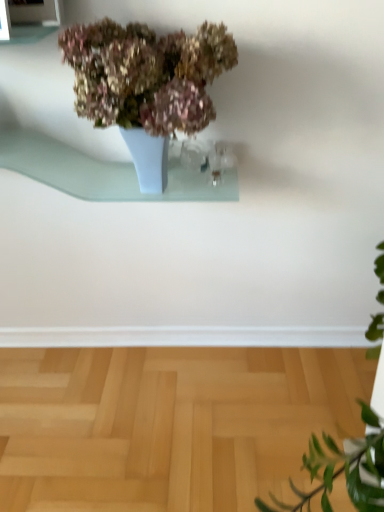
Question: From a real-world perspective, is matte ceramic vase at upper center physically above light wood parquet floor at lower center?

Choices:
 (A) yes
 (B) no

Answer: (A)

Question: From the image's perspective, would you say matte ceramic vase at upper center is shown under light wood parquet floor at lower center?

Choices:
 (A) yes
 (B) no

Answer: (B)

Question: Is matte ceramic vase at upper center in contact with light wood parquet floor at lower center?

Choices:
 (A) yes
 (B) no

Answer: (B)

Question: Is matte ceramic vase at upper center positioned in front of light wood parquet floor at lower center?

Choices:
 (A) yes
 (B) no

Answer: (A)

Question: Is matte ceramic vase at upper center positioned with its back to light wood parquet floor at lower center?

Choices:
 (A) yes
 (B) no

Answer: (B)

Question: Is light wood parquet floor at lower center bigger or smaller than matte ceramic vase at upper center?

Choices:
 (A) big
 (B) small

Answer: (A)

Question: Does point (119, 423) appear closer or farther from the camera than point (89, 109)?

Choices:
 (A) closer
 (B) farther

Answer: (B)

Question: Relative to matte ceramic vase at upper center, is light wood parquet floor at lower center in front or behind?

Choices:
 (A) front
 (B) behind

Answer: (B)

Question: Considering the positions of light wood parquet floor at lower center and matte ceramic vase at upper center in the image, is light wood parquet floor at lower center wider or thinner than matte ceramic vase at upper center?

Choices:
 (A) wide
 (B) thin

Answer: (A)

Question: Is light blue glass shelf at upper center taller or shorter than light wood parquet floor at lower center?

Choices:
 (A) tall
 (B) short

Answer: (A)

Question: From a real-world perspective, is light blue glass shelf at upper center physically located above or below light wood parquet floor at lower center?

Choices:
 (A) above
 (B) below

Answer: (A)

Question: Is light blue glass shelf at upper center bigger or smaller than light wood parquet floor at lower center?

Choices:
 (A) big
 (B) small

Answer: (B)

Question: Visually, is light blue glass shelf at upper center positioned to the left or to the right of light wood parquet floor at lower center?

Choices:
 (A) right
 (B) left

Answer: (B)

Question: Relative to matte ceramic vase at upper center, is light blue glass shelf at upper center in front or behind?

Choices:
 (A) front
 (B) behind

Answer: (B)

Question: Is point (122, 182) positioned closer to the camera than point (178, 69)?

Choices:
 (A) farther
 (B) closer

Answer: (A)